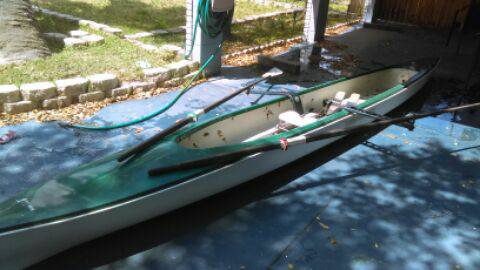
Identify the location of decorative wall. The height and width of the screenshot is (270, 480). (45, 97).